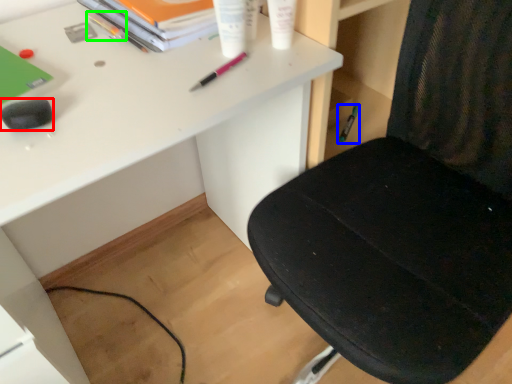
Question: Which object is the closest to the stationery (highlighted by a red box)? Choose among these: stationery (highlighted by a blue box) or stationery (highlighted by a green box).

Choices:
 (A) stationery
 (B) stationery

Answer: (B)